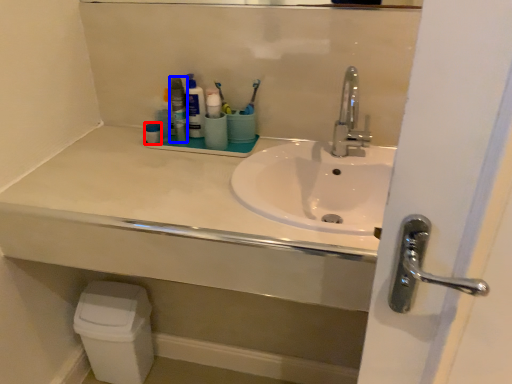
Question: Which object is further to the camera taking this photo, toiletry (highlighted by a red box) or mouthwash (highlighted by a blue box)?

Choices:
 (A) toiletry
 (B) mouthwash

Answer: (A)